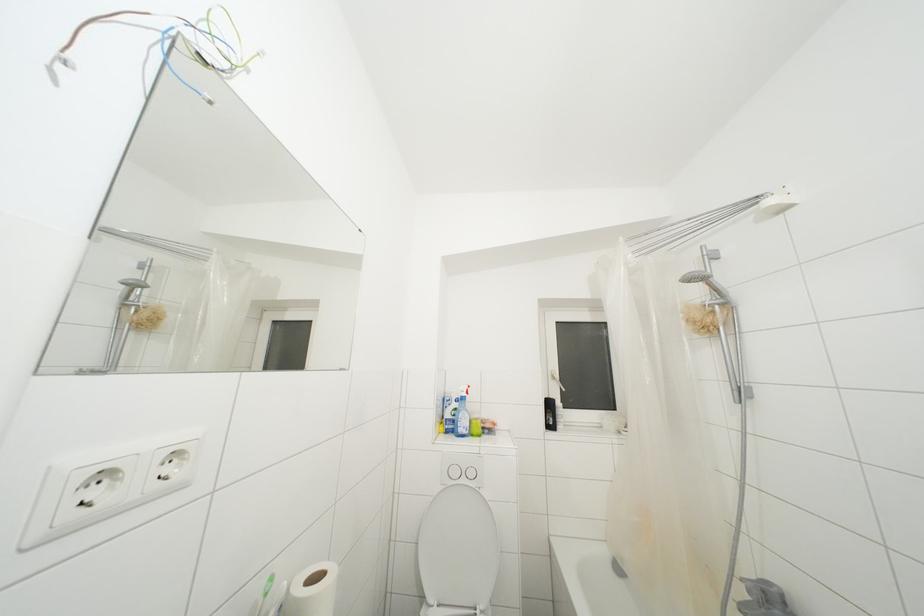
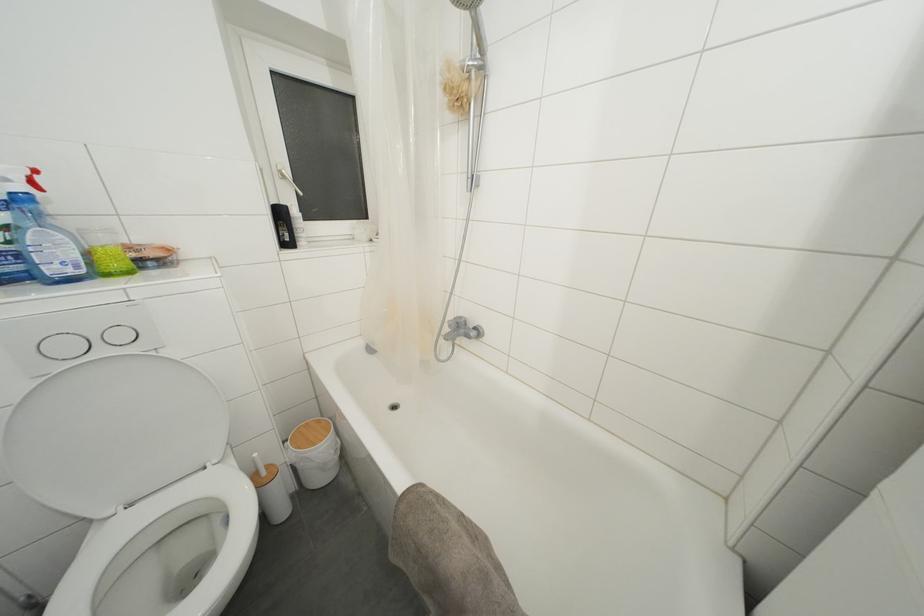
In the second image, find the point that corresponds to (748,576) in the first image.

(455, 321)